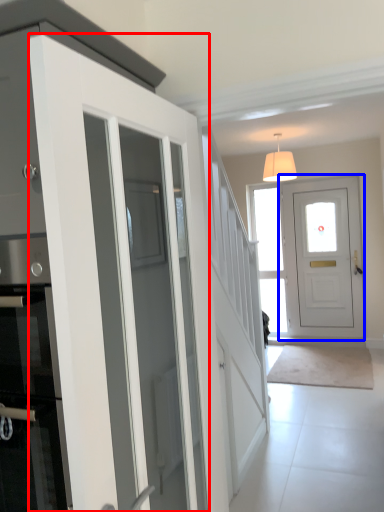
Question: Which point is further to the camera, door (highlighted by a red box) or door (highlighted by a blue box)?

Choices:
 (A) door
 (B) door

Answer: (B)